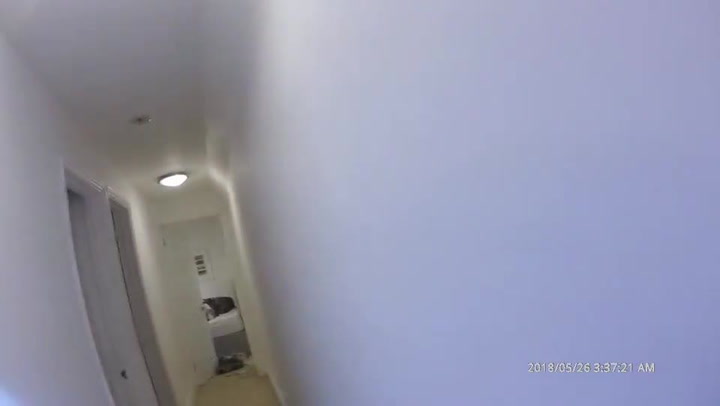
Identify the location of floor. Image resolution: width=720 pixels, height=406 pixels. (220, 389), (265, 389), (252, 395), (234, 381).